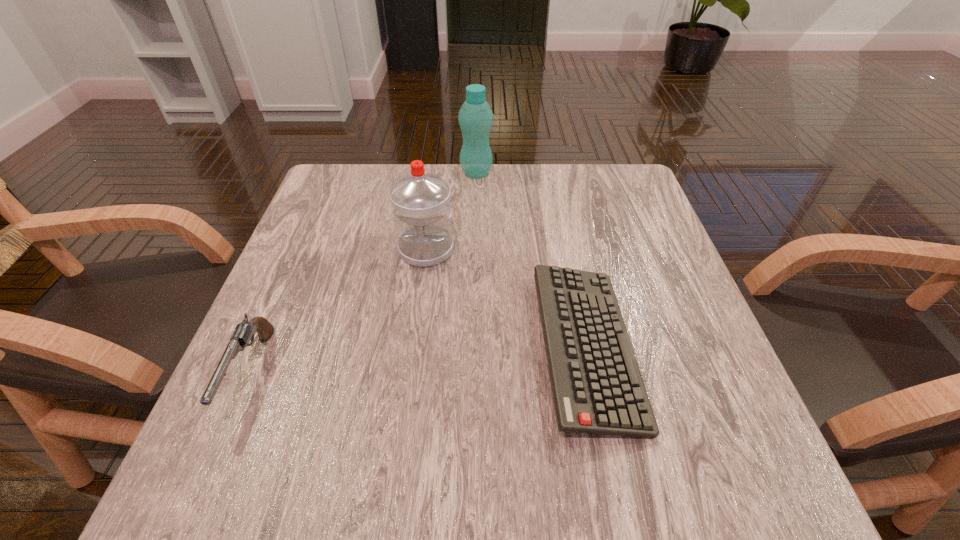
Locate an element on the screen. The width and height of the screenshot is (960, 540). vacant space at the right edge is located at coordinates (636, 274).

Image resolution: width=960 pixels, height=540 pixels. I want to click on free location at the far left corner of the desktop, so click(350, 212).

This screenshot has height=540, width=960. In the image, there is a desktop. What are the coordinates of `blank space at the near left corner` in the screenshot? It's located at (204, 470).

Where is `blank space at the far right corner of the desktop`? The width and height of the screenshot is (960, 540). blank space at the far right corner of the desktop is located at coordinates (590, 163).

At what (x,y) coordinates should I click in order to perform the action: click on free space between the computer keyboard and the bottle. Please return your answer as a coordinate pair (x, y). Looking at the image, I should click on (531, 260).

I want to click on free space that is in between the rightmost object and the leftmost object, so click(419, 360).

Find the location of a particular element. The width and height of the screenshot is (960, 540). empty space between the bottle and the gun is located at coordinates (363, 273).

This screenshot has width=960, height=540. What are the coordinates of `vacant space that's between the computer keyboard and the gun` in the screenshot? It's located at (419, 360).

At what (x,y) coordinates should I click in order to perform the action: click on empty location between the gun and the second farthest object. Please return your answer as a coordinate pair (x, y). The width and height of the screenshot is (960, 540). Looking at the image, I should click on (339, 311).

Locate an element on the screen. The image size is (960, 540). vacant area that lies between the leftmost object and the computer keyboard is located at coordinates (419, 360).